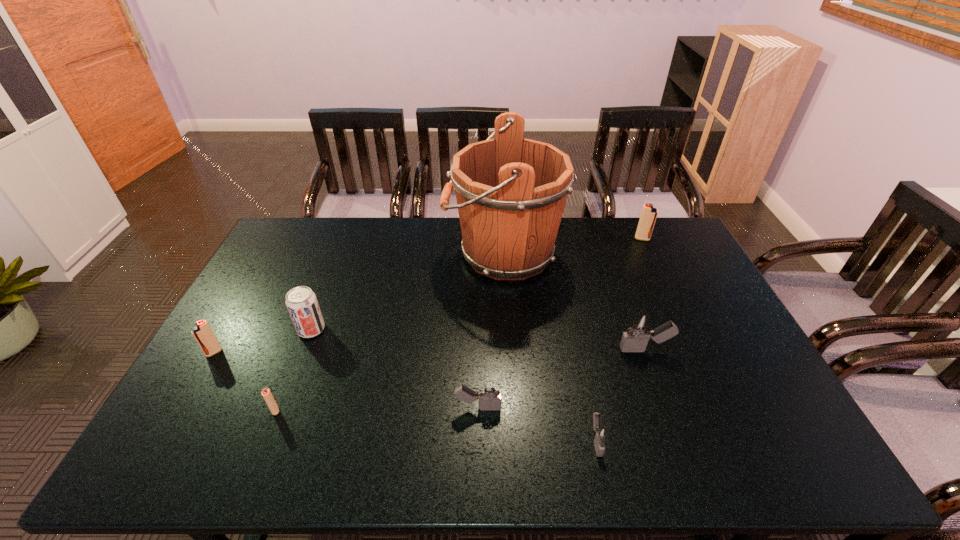
Where is `vacant space located 0.310m on the back of the third igniter from left to right`? The height and width of the screenshot is (540, 960). vacant space located 0.310m on the back of the third igniter from left to right is located at coordinates (478, 312).

Identify the location of vacant space located on the front of the second nearest red igniter. coord(146,469).

Where is `free space located on the right of the smallest red igniter`? This screenshot has width=960, height=540. free space located on the right of the smallest red igniter is located at coordinates (368, 410).

I want to click on vacant point located 0.360m on the right of the second gray igniter from left to right, so click(756, 440).

Image resolution: width=960 pixels, height=540 pixels. Identify the location of bucket that is at the far edge. (511, 191).

What are the coordinates of `igniter located at the far edge` in the screenshot? It's located at (649, 214).

Locate an element on the screen. This screenshot has height=540, width=960. object that is at the near edge is located at coordinates (600, 434).

This screenshot has height=540, width=960. Identify the location of object located in the left edge section of the desktop. (203, 334).

Find the location of a particular element. Image resolution: width=960 pixels, height=540 pixels. object present at the right edge is located at coordinates (649, 214).

Image resolution: width=960 pixels, height=540 pixels. Identify the location of object situated at the far right corner. (649, 214).